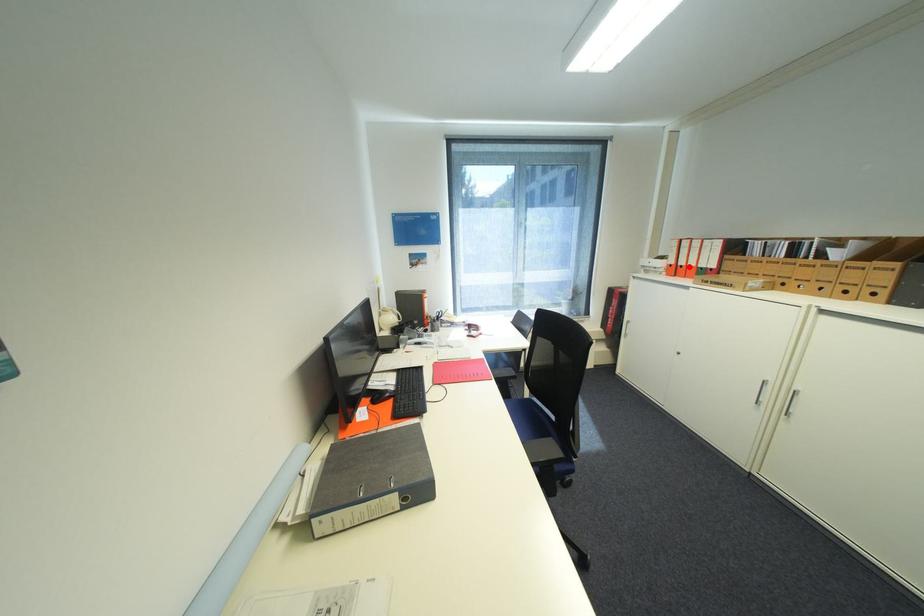
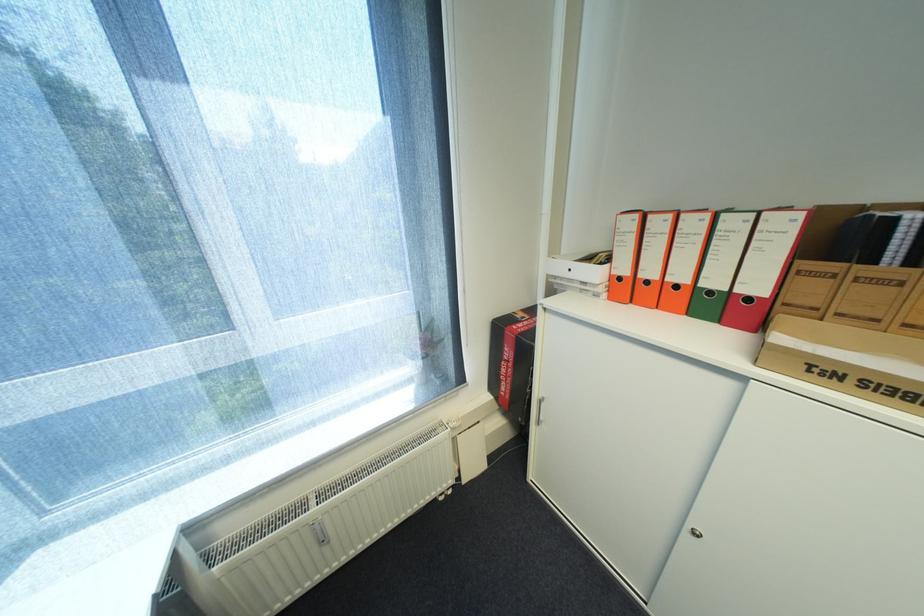
In the second image, find the point that corresponds to the highlighted location in the first image.

(655, 283)